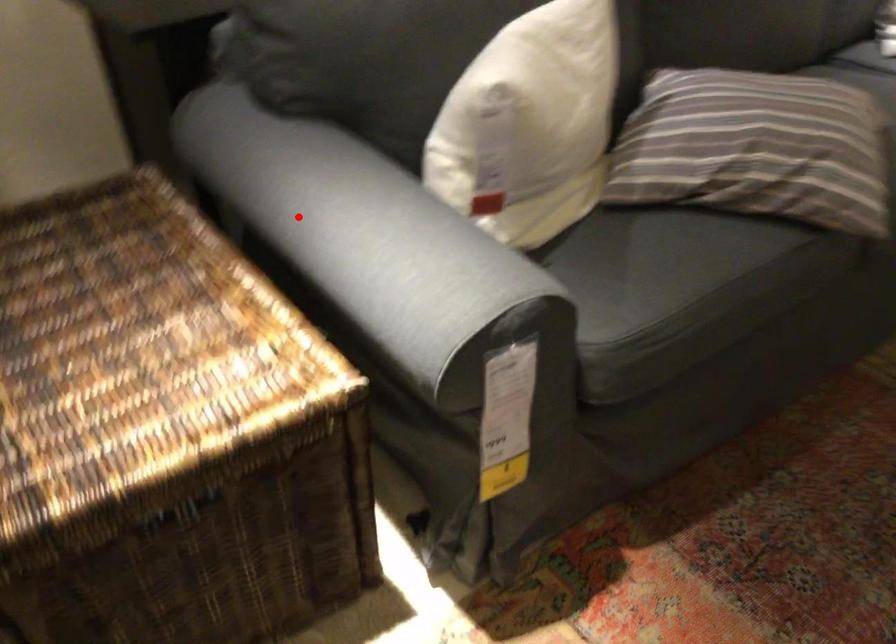
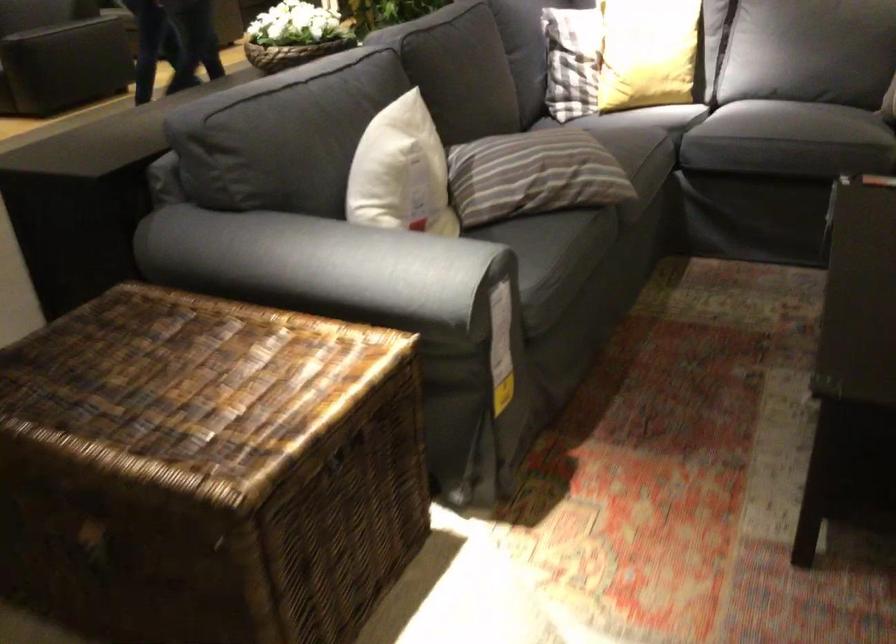
Question: A red point is marked in image1. In image2, is the corresponding 3D point closer to the camera or farther? Reply with the corresponding letter.

Choices:
 (A) The corresponding 3D point is closer.
 (B) The corresponding 3D point is farther.

Answer: (B)